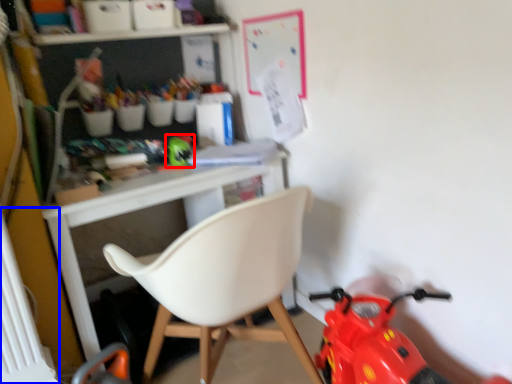
Question: Which of the following is the closest to the observer, toy (highlighted by a red box) or radiator (highlighted by a blue box)?

Choices:
 (A) toy
 (B) radiator

Answer: (B)